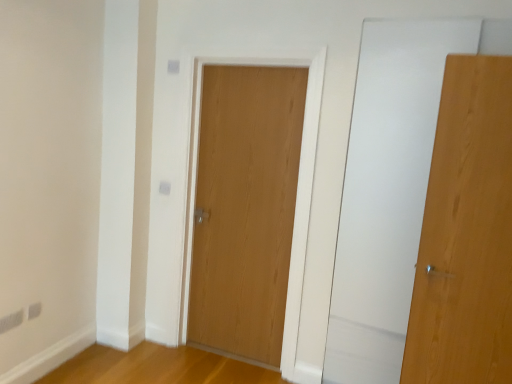
Identify the location of vacant space in light oak wood door at center, positioned as the 2th door in right-to-left order (from a real-world perspective). The width and height of the screenshot is (512, 384). (228, 350).